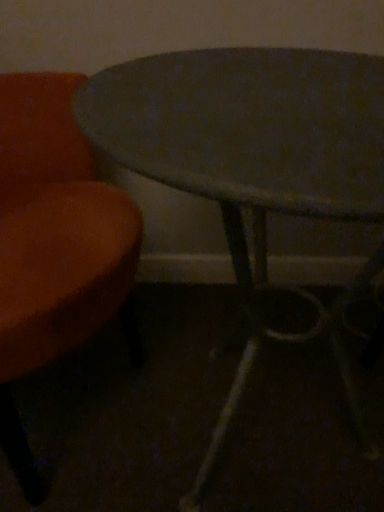
Image resolution: width=384 pixels, height=512 pixels. What are the coordinates of `vacant space situated above metallic gray table at center (from a real-world perspective)` in the screenshot? It's located at (254, 86).